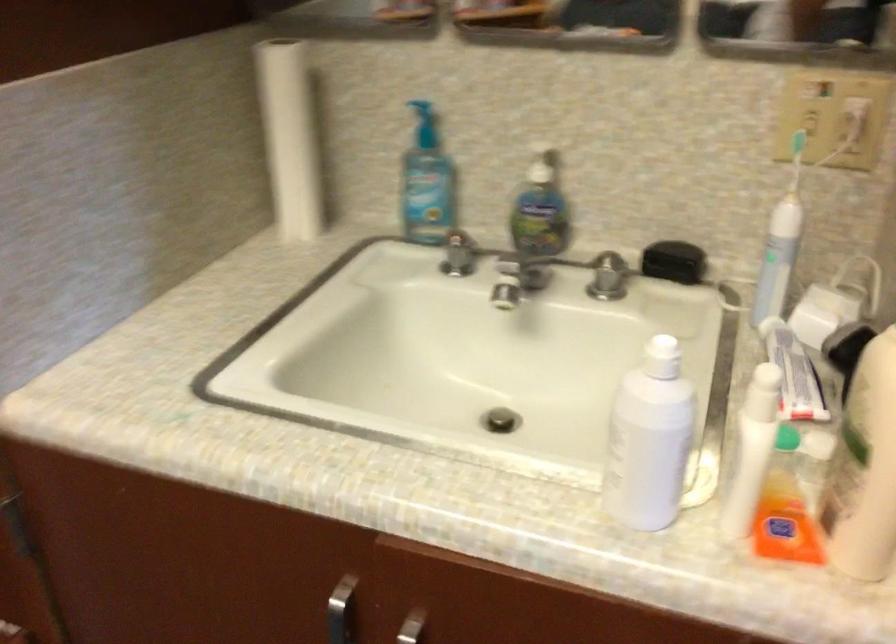
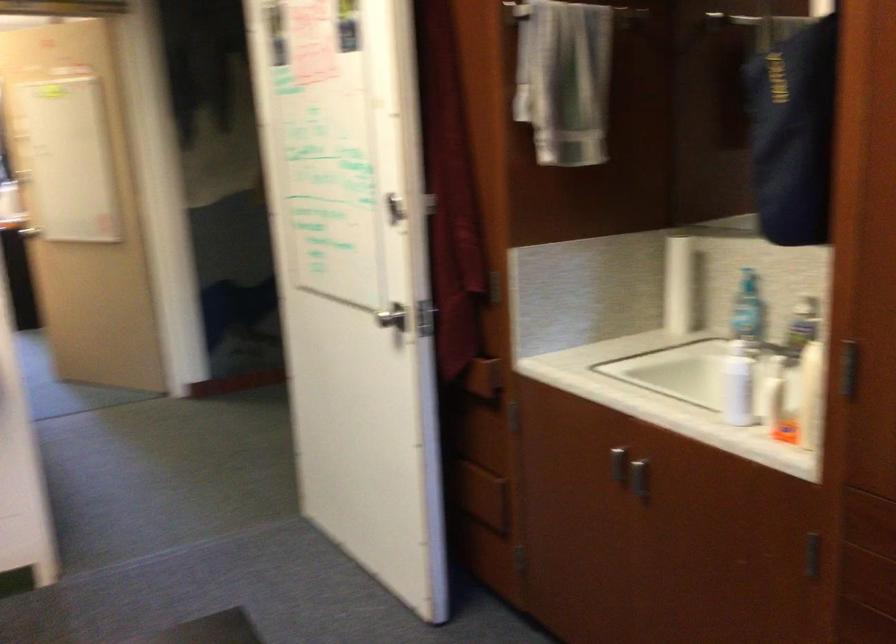
Find the pixel in the second image that matches point (677, 453) in the first image.

(737, 384)